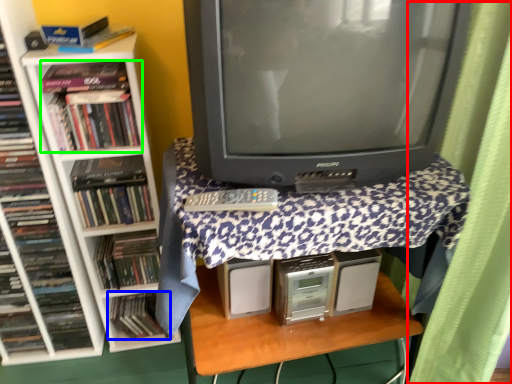
Question: Estimate the real-world distances between objects in this image. Which object is closer to curtain (highlighted by a red box), book (highlighted by a blue box) or book (highlighted by a green box)?

Choices:
 (A) book
 (B) book

Answer: (B)